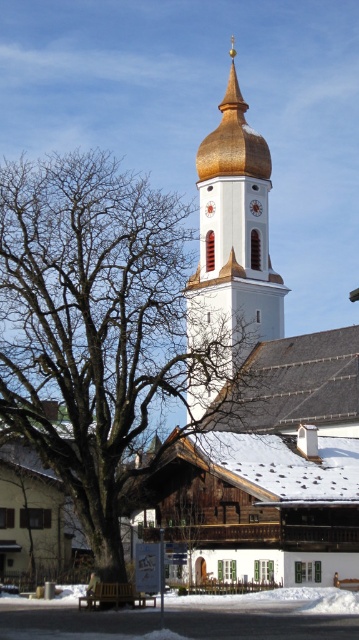
Question: Which point appears closest to the camera in this image?

Choices:
 (A) (36, 376)
 (B) (229, 150)

Answer: (A)

Question: Is bare wood tree at left thinner than white smooth tower at center?

Choices:
 (A) no
 (B) yes

Answer: (A)

Question: Which point is closer to the camera?

Choices:
 (A) white smooth tower at center
 (B) bare wood tree at left

Answer: (B)

Question: Among these objects, which one is farthest from the camera?

Choices:
 (A) bare wood tree at left
 (B) white smooth tower at center

Answer: (B)

Question: Is bare wood tree at left above white smooth tower at center?

Choices:
 (A) no
 (B) yes

Answer: (A)

Question: Does bare wood tree at left lie in front of white smooth tower at center?

Choices:
 (A) yes
 (B) no

Answer: (A)